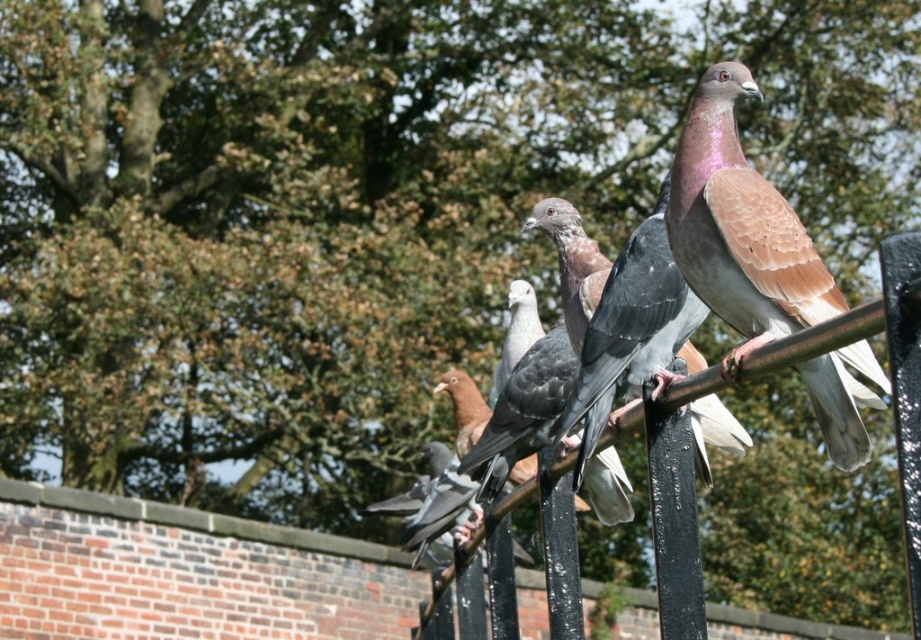
Question: Can you confirm if purple-brown feathered pigeon at center is positioned to the right of brown speckled feathers at center?

Choices:
 (A) no
 (B) yes

Answer: (B)

Question: Which point appears closest to the camera in this image?

Choices:
 (A) (710, 147)
 (B) (602, 276)

Answer: (A)

Question: Which of the following is the closest to the observer?

Choices:
 (A) purple-brown feathered pigeon at center
 (B) brown speckled feathers at center

Answer: (A)

Question: Does purple-brown feathered pigeon at center come in front of brown speckled feathers at center?

Choices:
 (A) no
 (B) yes

Answer: (B)

Question: Does purple-brown feathered pigeon at center have a larger size compared to brown speckled feathers at center?

Choices:
 (A) no
 (B) yes

Answer: (A)

Question: Which point appears farthest from the camera in this image?

Choices:
 (A) (780, 269)
 (B) (729, 445)

Answer: (B)